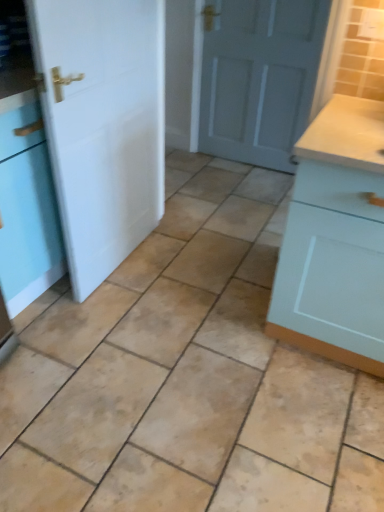
Question: Is matte gray door at center, marked as the 2th door in a left-to-right arrangement, next to white matte door at left, which ranks as the second door in right-to-left order?

Choices:
 (A) no
 (B) yes

Answer: (A)

Question: Can you confirm if matte gray door at center, placed as the 1th door when sorted from right to left, is thinner than white matte door at left, arranged as the first door when viewed from the left?

Choices:
 (A) no
 (B) yes

Answer: (B)

Question: From a real-world perspective, is matte gray door at center, placed as the 1th door when sorted from right to left, on top of white matte door at left, which ranks as the second door in right-to-left order?

Choices:
 (A) yes
 (B) no

Answer: (B)

Question: From a real-world perspective, is matte gray door at center, placed as the 1th door when sorted from right to left, beneath white matte door at left, which ranks as the second door in right-to-left order?

Choices:
 (A) yes
 (B) no

Answer: (A)

Question: Can you confirm if matte gray door at center, placed as the 1th door when sorted from right to left, is bigger than white matte door at left, which ranks as the second door in right-to-left order?

Choices:
 (A) no
 (B) yes

Answer: (A)

Question: Considering the relative positions of matte gray door at center, which appears as the first door when viewed from the back, and white matte door at left, acting as the second door starting from the back, in the image provided, is matte gray door at center, which appears as the first door when viewed from the back, to the left or to the right of white matte door at left, acting as the second door starting from the back,?

Choices:
 (A) left
 (B) right

Answer: (B)

Question: In terms of width, does matte gray door at center, which appears as the first door when viewed from the back, look wider or thinner when compared to white matte door at left, arranged as the first door when viewed from the left?

Choices:
 (A) thin
 (B) wide

Answer: (A)

Question: Is point (208, 132) closer or farther from the camera than point (110, 172)?

Choices:
 (A) closer
 (B) farther

Answer: (B)

Question: Choose the correct answer: Is matte gray door at center, the second door viewed from the front, inside white matte door at left, which ranks as the second door in right-to-left order, or outside it?

Choices:
 (A) outside
 (B) inside

Answer: (A)

Question: In terms of size, does white matte door at left, which ranks as the 1th door in front-to-back order, appear bigger or smaller than beige ceramic tile at center?

Choices:
 (A) small
 (B) big

Answer: (A)

Question: Looking at their shapes, would you say white matte door at left, acting as the second door starting from the back, is wider or thinner than beige ceramic tile at center?

Choices:
 (A) thin
 (B) wide

Answer: (A)

Question: Choose the correct answer: Is white matte door at left, arranged as the first door when viewed from the left, inside beige ceramic tile at center or outside it?

Choices:
 (A) inside
 (B) outside

Answer: (B)

Question: Is point (43, 52) positioned closer to the camera than point (119, 297)?

Choices:
 (A) farther
 (B) closer

Answer: (B)

Question: Do you think beige ceramic tile at center is within light blue wood cabinet at right, or outside of it?

Choices:
 (A) inside
 (B) outside

Answer: (B)

Question: Looking at the image, does beige ceramic tile at center seem bigger or smaller compared to light blue wood cabinet at right?

Choices:
 (A) big
 (B) small

Answer: (B)